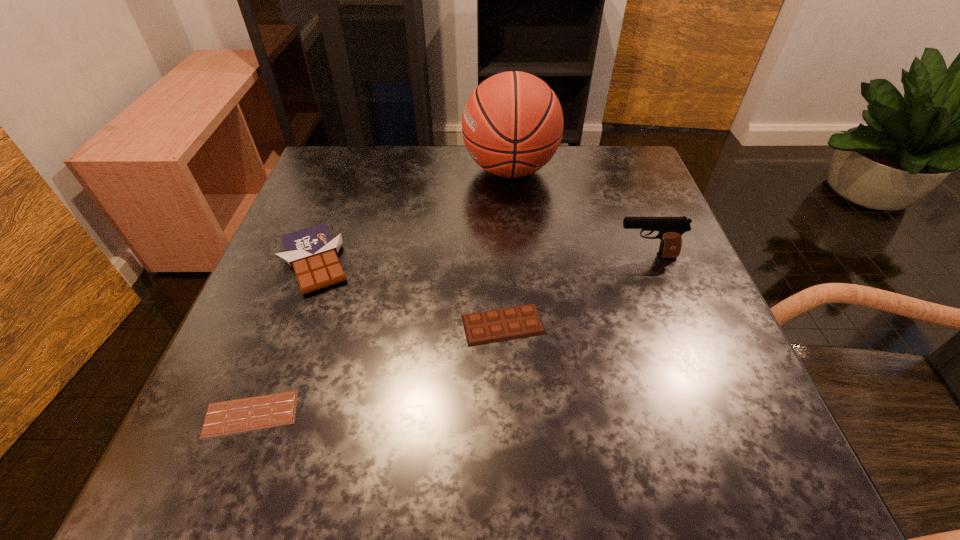
Locate an element on the screen. This screenshot has width=960, height=540. the tallest object is located at coordinates (512, 125).

What are the coordinates of `the farthest object` in the screenshot? It's located at (512, 125).

This screenshot has height=540, width=960. What are the coordinates of `the fourth shortest object` in the screenshot? It's located at (671, 229).

Where is `pistol`? This screenshot has width=960, height=540. pistol is located at coordinates (671, 229).

Identify the location of the farthest chocolate bar. The image size is (960, 540). (312, 252).

The height and width of the screenshot is (540, 960). Identify the location of the third tallest object. (312, 252).

You are a GUI agent. You are given a task and a screenshot of the screen. Output one action in this format:
    pyautogui.click(x=<x>, y=<y>)
    Task: Click on the second nearest object
    Image resolution: width=960 pixels, height=540 pixels.
    Given the screenshot: What is the action you would take?
    [x=498, y=325]

Identify the location of the rightmost chocolate bar. 498,325.

Locate an element on the screen. the shortest chocolate bar is located at coordinates (254, 413).

You are a GUI agent. You are given a task and a screenshot of the screen. Output one action in this format:
    pyautogui.click(x=<x>, y=<y>)
    Task: Click on the nearest object
    
    Given the screenshot: What is the action you would take?
    pyautogui.click(x=254, y=413)